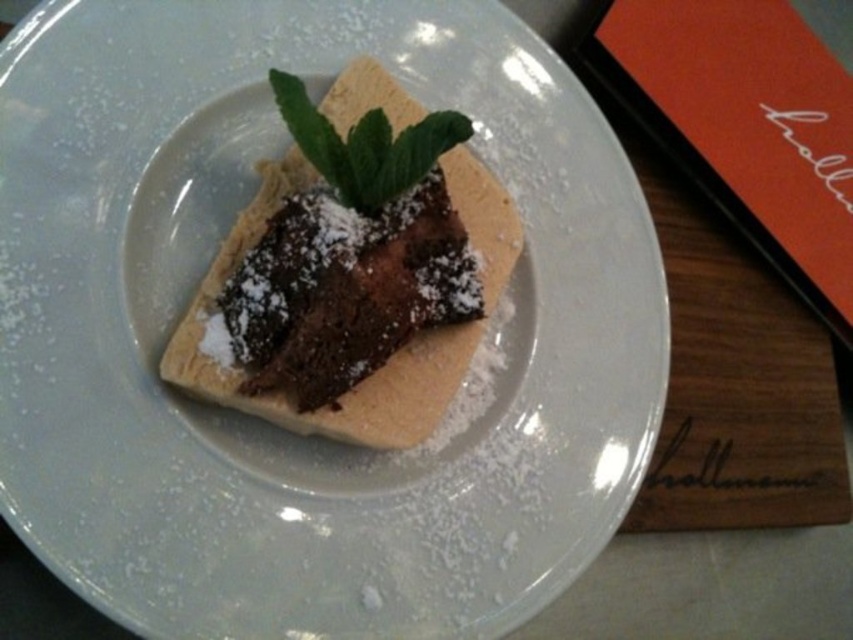
Is chocolate matte brownie at center thinner than green leafy mint at center?

No.

Where is `chocolate matte brownie at center`? chocolate matte brownie at center is located at coordinates (346, 289).